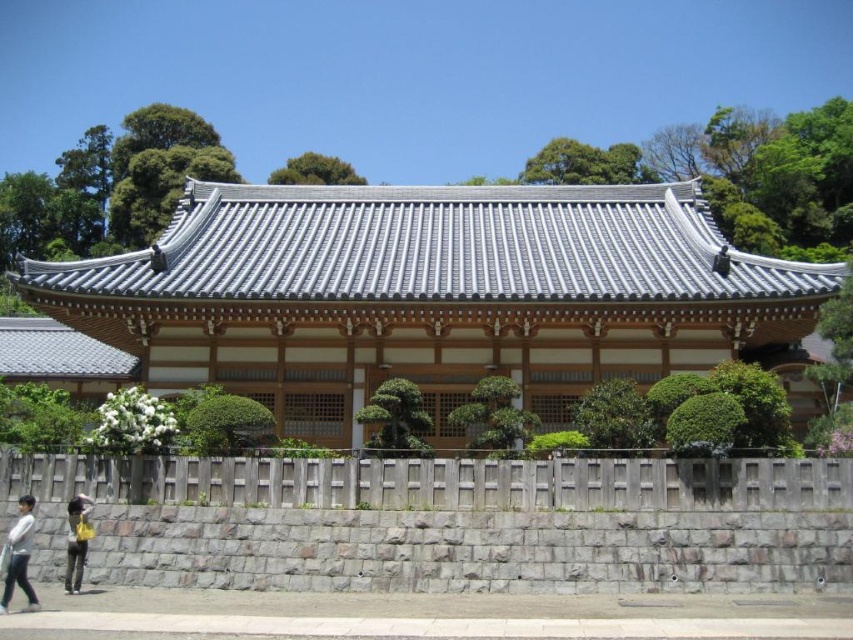
Question: Does gray tile roof at center have a lesser width compared to white cotton shirt at lower left?

Choices:
 (A) no
 (B) yes

Answer: (A)

Question: Can you confirm if white cotton shirt at lower left is thinner than yellow fabric bag at lower left?

Choices:
 (A) yes
 (B) no

Answer: (B)

Question: Does gray tile roof at center have a smaller size compared to white cotton shirt at lower left?

Choices:
 (A) yes
 (B) no

Answer: (B)

Question: Which of these objects is positioned closest to the gray tile roof at center?

Choices:
 (A) white cotton shirt at lower left
 (B) yellow fabric bag at lower left

Answer: (B)

Question: Which of the following is the closest to the observer?

Choices:
 (A) (27, 556)
 (B) (65, 582)
 (C) (370, 208)

Answer: (A)

Question: Which point appears closest to the camera in this image?

Choices:
 (A) (19, 573)
 (B) (596, 362)

Answer: (A)